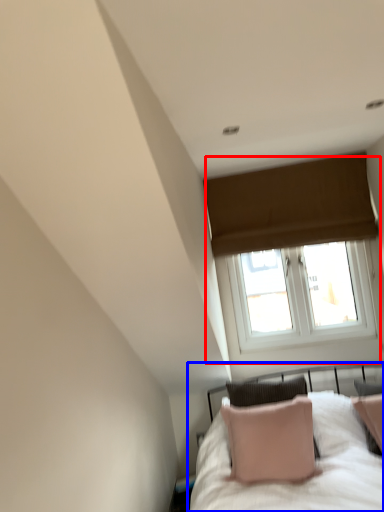
Question: Among these objects, which one is nearest to the camera, window (highlighted by a red box) or bed (highlighted by a blue box)?

Choices:
 (A) window
 (B) bed

Answer: (B)